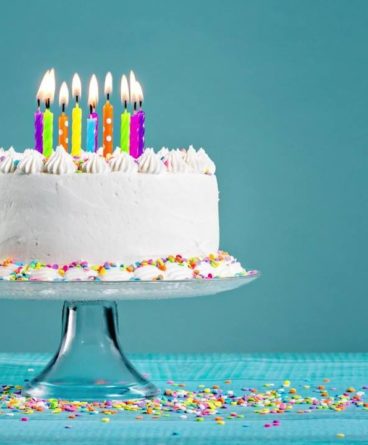
Image resolution: width=368 pixels, height=445 pixels. I want to click on candles, so click(x=37, y=127), click(x=46, y=133), click(x=61, y=132), click(x=75, y=136), click(x=89, y=131), click(x=94, y=117), click(x=107, y=127), click(x=124, y=133), click(x=133, y=132), click(x=142, y=127).